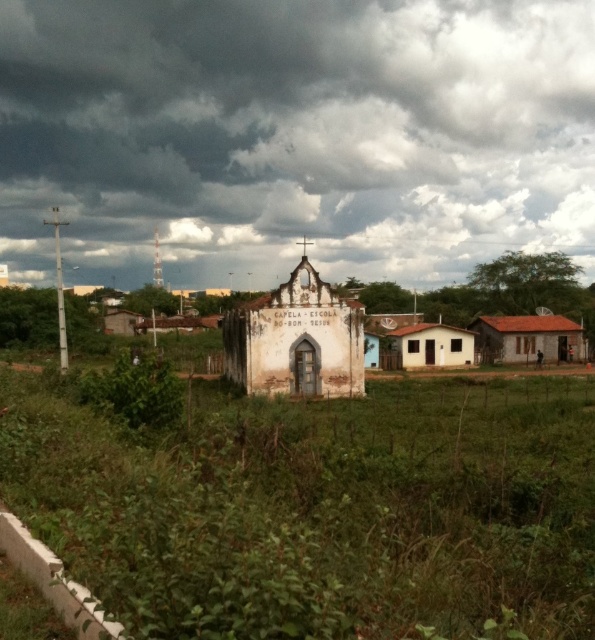
You are a photographer trying to capture the white weathered chapel at center and the green leafy plant at lower left in the same frame. Based on their sizes in the image, which one would appear larger in your photo?

The white weathered chapel at center appears much larger in the photo because it is much taller than the green leafy plant at lower left.

You are a photographer trying to capture the white weathered chapel at center against the dramatic sky. Considering the size of the dark gray cloud at upper center, will it block the entire chapel in your shot?

The dark gray cloud at upper center is bigger than the white weathered chapel at center, so it might block part of the chapel but not entirely, depending on the camera angle and zoom.

You are a landscape architect planning to install a new pathway between the white weathered chapel at center and the green leafy plant at lower left. Given their sizes, which object requires more space to accommodate on the path?

Result: The white weathered chapel at center requires more space because its width is larger than the green leafy plant at lower left.